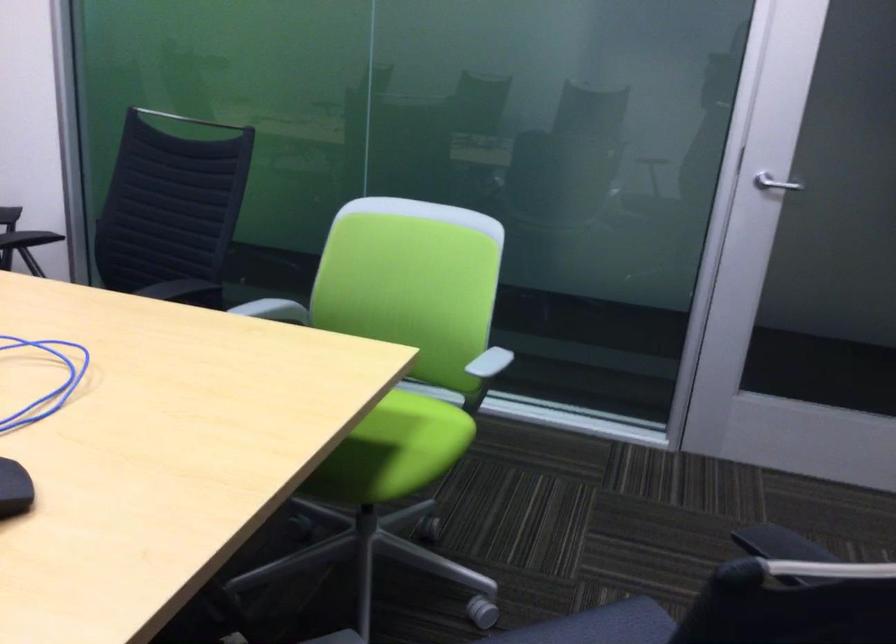
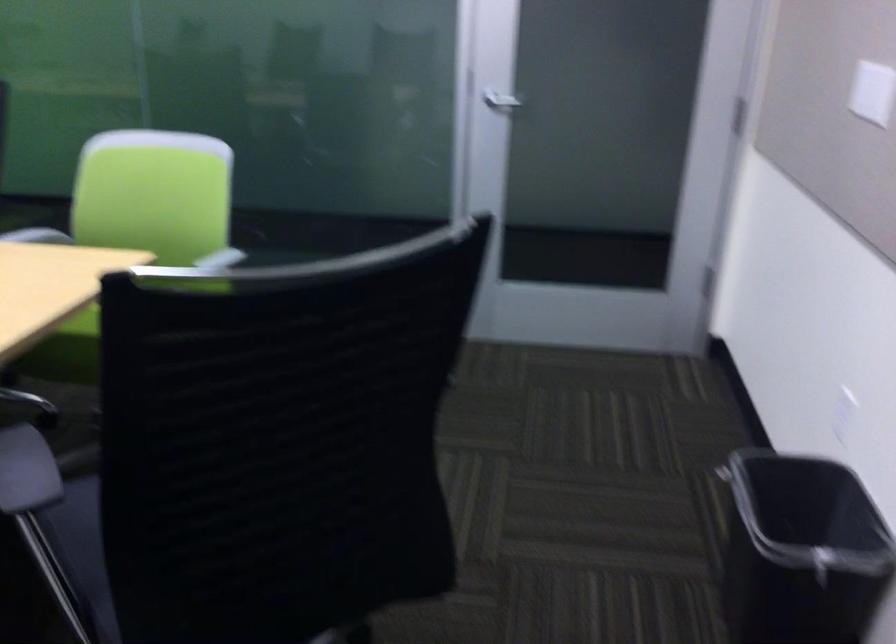
The point at (x=780, y=187) is marked in the first image. Where is the corresponding point in the second image?

(501, 102)